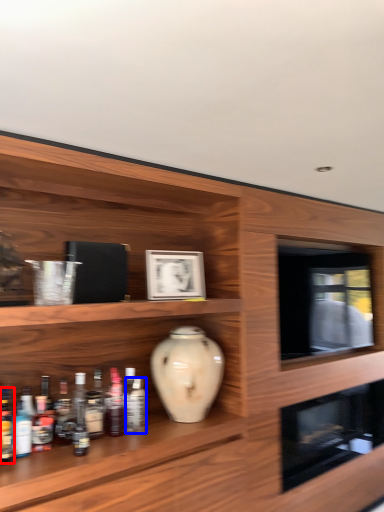
Question: Which object is further to the camera taking this photo, bottle (highlighted by a red box) or bottle (highlighted by a blue box)?

Choices:
 (A) bottle
 (B) bottle

Answer: (B)